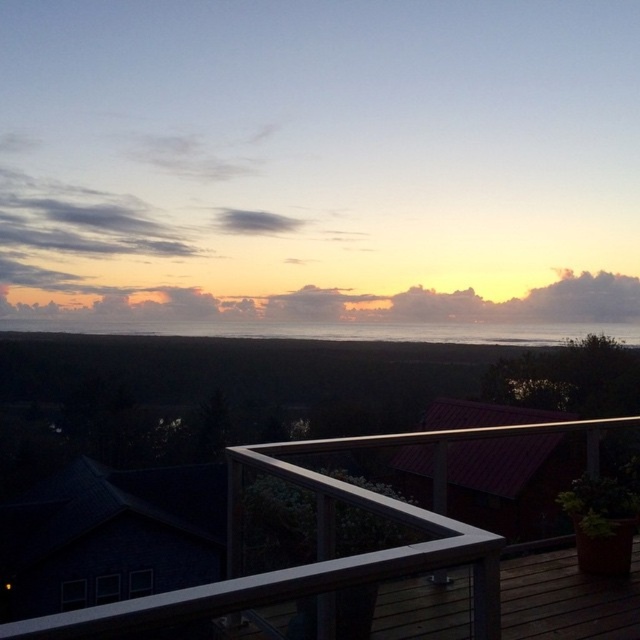
Is point (388, 573) positioned after point (216, 328)?

No, (388, 573) is in front of (216, 328).

Does point (321, 609) come in front of point (80, 323)?

Yes, it is in front of point (80, 323).

Find the location of `white glass railing at upper center`. white glass railing at upper center is located at coordinates (321, 547).